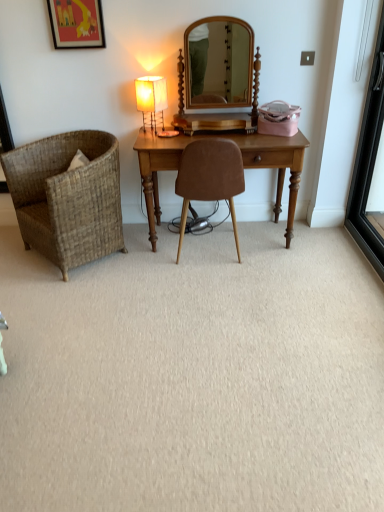
Where is `free space in front of wooden desk at center`? This screenshot has width=384, height=512. free space in front of wooden desk at center is located at coordinates (236, 293).